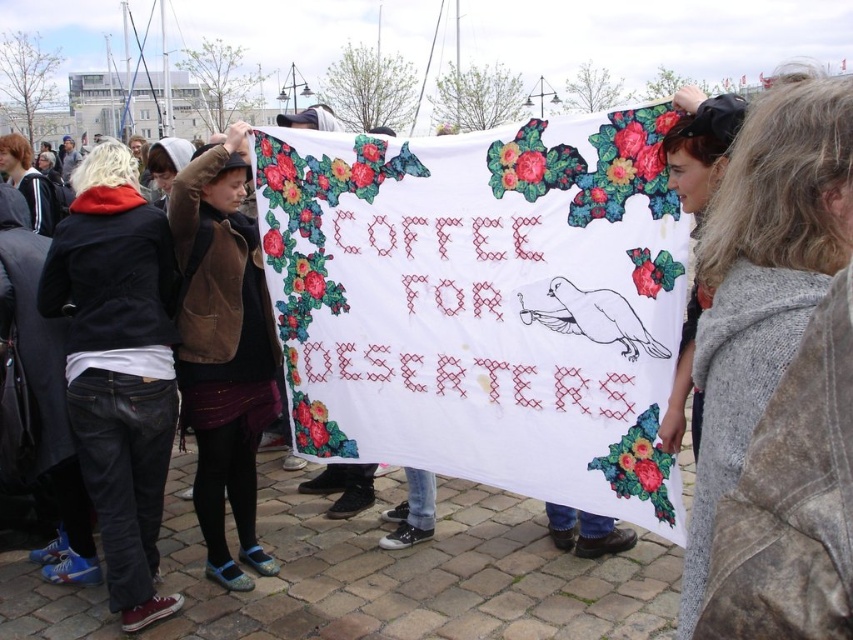
Question: Does leather jacket at left have a lesser width compared to brown suede jacket at center?

Choices:
 (A) no
 (B) yes

Answer: (A)

Question: Does gray knit sweater at center appear over brown suede jacket at center?

Choices:
 (A) no
 (B) yes

Answer: (B)

Question: Estimate the real-world distances between objects in this image. Which object is farther from the leather jacket at left?

Choices:
 (A) brown suede jacket at center
 (B) matte black jacket at left
 (C) gray knit sweater at center

Answer: (C)

Question: Among these points, which one is nearest to the camera?

Choices:
 (A) (218, 429)
 (B) (120, 481)

Answer: (B)

Question: Which object is closer to the camera taking this photo?

Choices:
 (A) matte black jacket at left
 (B) gray knit sweater at center
 (C) brown suede jacket at center

Answer: (B)

Question: Can you confirm if gray knit sweater at center is positioned above leather jacket at left?

Choices:
 (A) yes
 (B) no

Answer: (A)